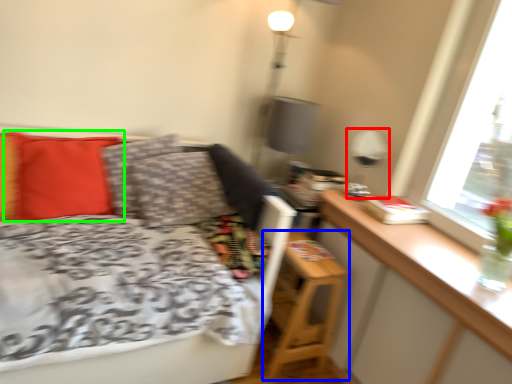
Question: Which object is the farthest from table lamp (highlighted by a red box)? Choose among these: nightstand (highlighted by a blue box) or pillow (highlighted by a green box).

Choices:
 (A) nightstand
 (B) pillow

Answer: (B)